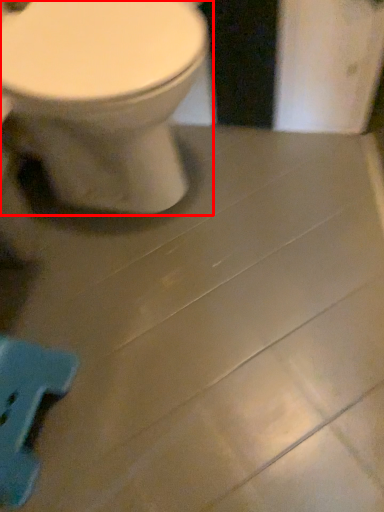
Question: Considering the relative positions of toilet (annotated by the red box) and porcelain in the image provided, where is toilet (annotated by the red box) located with respect to the staircase?

Choices:
 (A) right
 (B) left

Answer: (A)